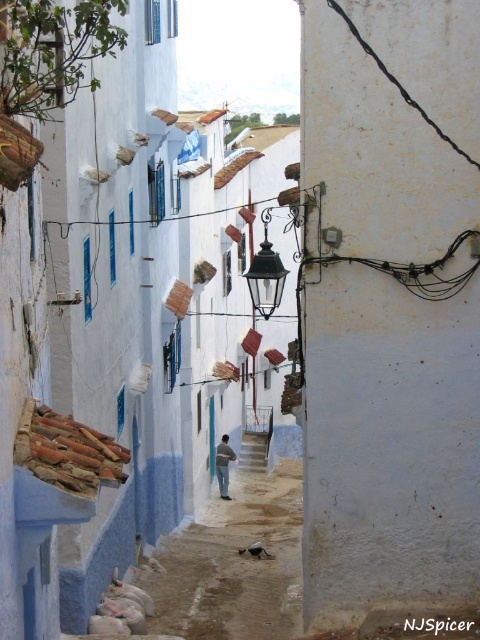
You are a delivery person carrying a large package that is 1 meter wide. You need to navigate through the narrow alleyway shown in the scene. The alley has a black glass lantern at center and smooth concrete stairs at center. Can your package fit through the space between these two objects?

The black glass lantern at center has a lesser width compared to the smooth concrete stairs at center. Since the package is 1 meter wide, it depends on the actual width of the narrower object. However, since the lantern is narrower, if the space between them is at least 1 meter, the package can fit. But without specific measurements, we cannot confirm. The description only states the lantern is narrower, not the exact width.

You are standing at the entrance of a narrow alleyway with light blue walls. You see a black glass lantern at center and a blue fabric man at center. If you want to reach both objects, which one would you need to walk further to get to?

Both the black glass lantern at center and the blue fabric man at center are at the same distance from you since they are both at the center of the alley. However, according to the description, the black glass lantern at center is 45.19 feet away from the blue fabric man at center, meaning they are positioned at the same central point but separated by that distance between them. Therefore, you don not need to walk further for either as they are both equidistant from your starting point.